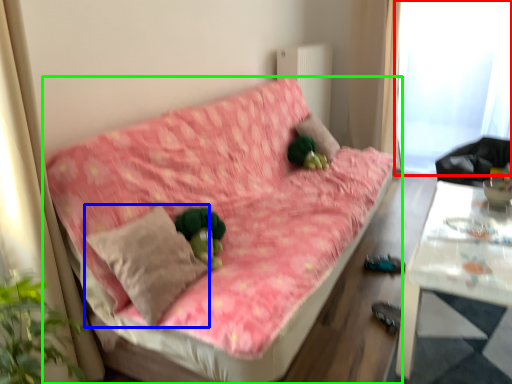
Question: Considering the real-world distances, which object is closest to window screen (highlighted by a red box)? throw pillow (highlighted by a blue box) or studio couch (highlighted by a green box).

Choices:
 (A) throw pillow
 (B) studio couch

Answer: (B)